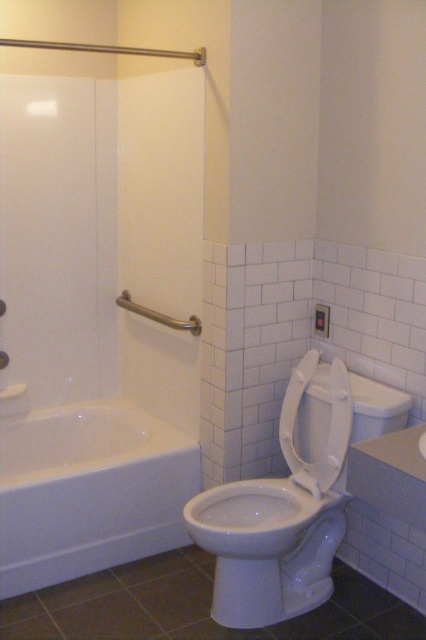
Looking at this image, does white glossy toilet at lower right have a larger size compared to white glossy toilet bowl at center?

Indeed, white glossy toilet at lower right has a larger size compared to white glossy toilet bowl at center.

This screenshot has width=426, height=640. What do you see at coordinates (279, 518) in the screenshot?
I see `white glossy toilet at lower right` at bounding box center [279, 518].

This screenshot has height=640, width=426. Find the location of `white glossy toilet at lower right`. white glossy toilet at lower right is located at coordinates coord(279,518).

Can you confirm if white glossy toilet at lower right is shorter than brushed metal grab bar at upper left?

In fact, white glossy toilet at lower right may be taller than brushed metal grab bar at upper left.

Who is positioned more to the right, white glossy toilet at lower right or brushed metal grab bar at upper left?

Positioned to the right is white glossy toilet at lower right.

Which is behind, point (284, 602) or point (152, 320)?

Positioned behind is point (152, 320).

The width and height of the screenshot is (426, 640). I want to click on white glossy toilet at lower right, so click(279, 518).

Is white glossy toilet bowl at center in front of brushed metal grab bar at upper left?

That is True.

Is white glossy toilet bowl at center bigger than brushed metal grab bar at upper left?

Indeed, white glossy toilet bowl at center has a larger size compared to brushed metal grab bar at upper left.

Where is `white glossy toilet bowl at center`? This screenshot has width=426, height=640. white glossy toilet bowl at center is located at coordinates (267, 548).